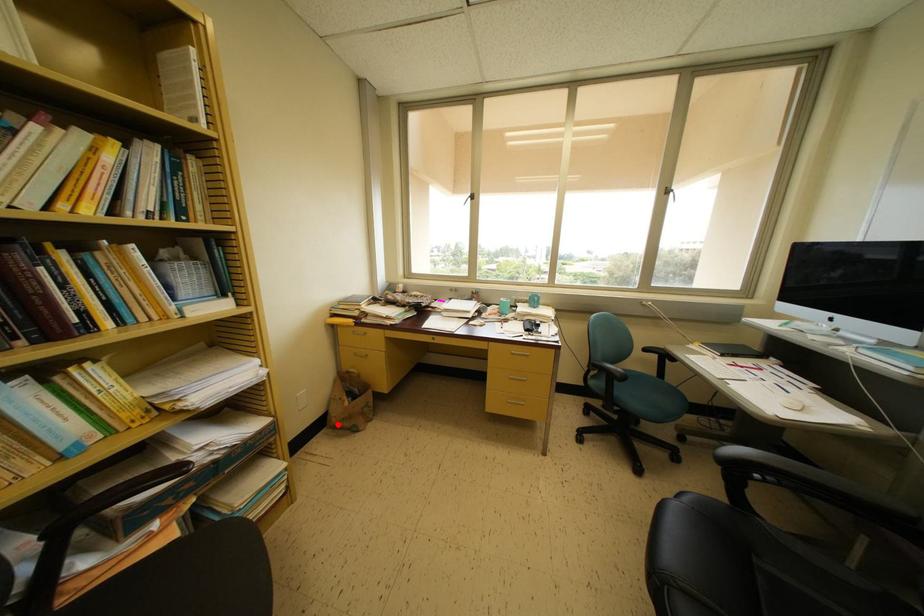
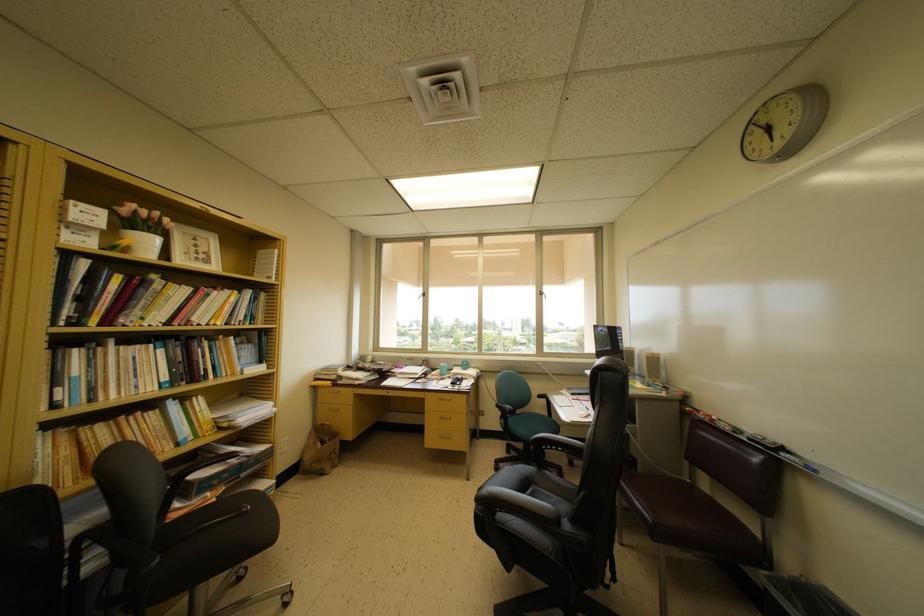
The point at the highlighted location is marked in the first image. Where is the corresponding point in the second image?

(310, 468)